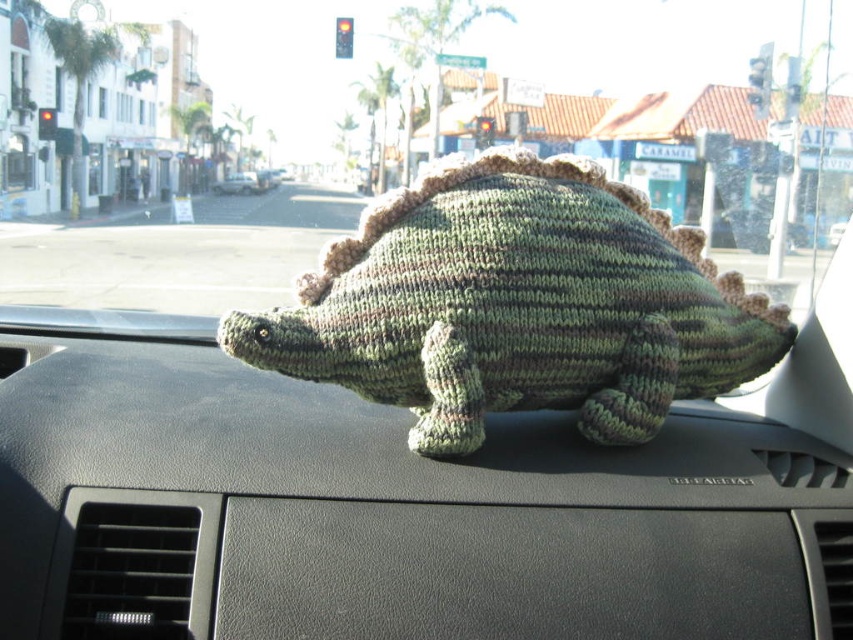
Question: Can you confirm if knitted green dinosaur at center is thinner than green knitted dinosaur at center?

Choices:
 (A) yes
 (B) no

Answer: (A)

Question: Which object is farther from the camera taking this photo?

Choices:
 (A) knitted green dinosaur at center
 (B) green knitted dinosaur at center

Answer: (B)

Question: Which point is closer to the camera taking this photo?

Choices:
 (A) (363, 323)
 (B) (251, 189)

Answer: (A)

Question: Among these objects, which one is nearest to the camera?

Choices:
 (A) green knitted dinosaur at center
 (B) knitted green dinosaur at center

Answer: (B)

Question: Is knitted green dinosaur at center positioned at the back of green knitted dinosaur at center?

Choices:
 (A) no
 (B) yes

Answer: (A)

Question: Is knitted green dinosaur at center positioned in front of green knitted dinosaur at center?

Choices:
 (A) yes
 (B) no

Answer: (A)